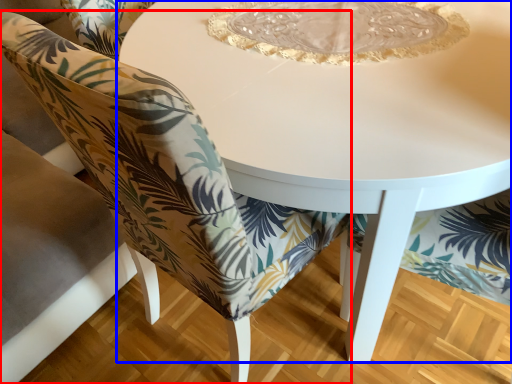
Question: Which of the following is the farthest to the observer, chair (highlighted by a red box) or table (highlighted by a blue box)?

Choices:
 (A) chair
 (B) table

Answer: (A)